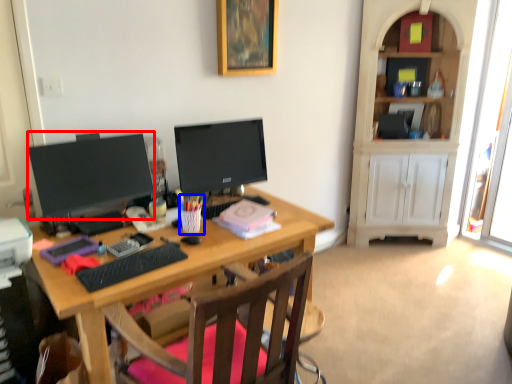
Question: Which object is closer to the camera taking this photo, television (highlighted by a red box) or stationery (highlighted by a blue box)?

Choices:
 (A) television
 (B) stationery

Answer: (A)